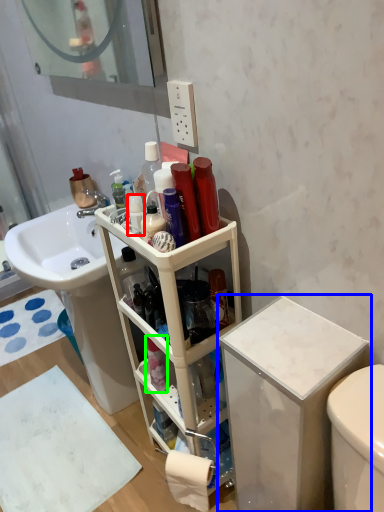
Question: Based on their relative distances, which object is farther from toiletry (highlighted by a red box)? Choose from cabinetry (highlighted by a blue box) and toiletry (highlighted by a green box).

Choices:
 (A) cabinetry
 (B) toiletry

Answer: (B)